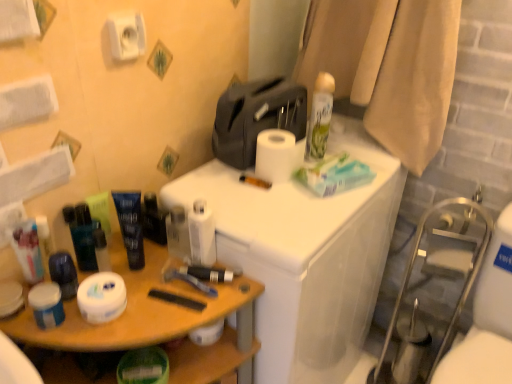
You are a GUI agent. You are given a task and a screenshot of the screen. Output one action in this format:
    pyautogui.click(x=<x>, y=<y>)
    Task: Click on the free space to the back side of white matte toilet paper at lower left, which is counted as the fourth toilet paper, starting from the right
    This screenshot has height=384, width=512.
    Given the screenshot: What is the action you would take?
    pyautogui.click(x=141, y=268)